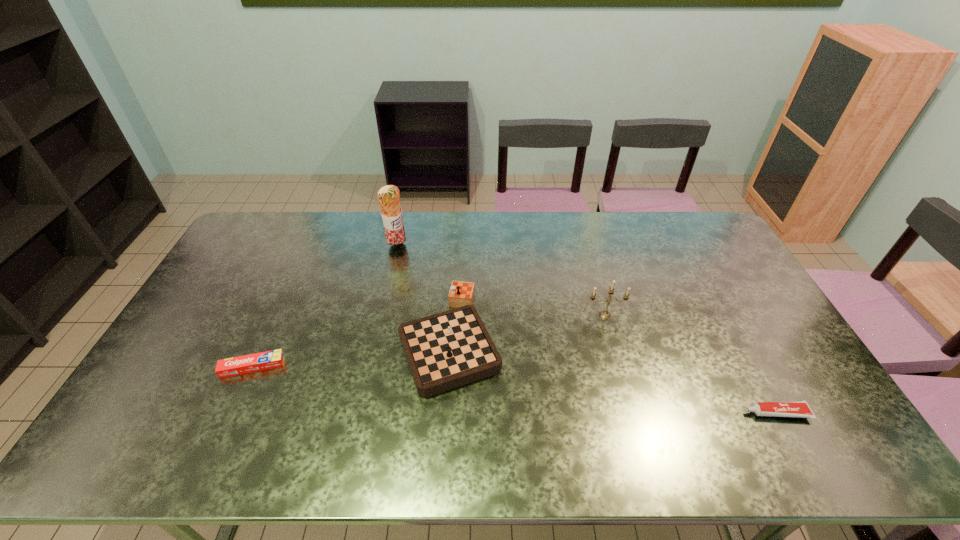
Locate an element on the screen. the tallest object is located at coordinates (388, 196).

This screenshot has width=960, height=540. What are the coordinates of `the farthest object` in the screenshot? It's located at (388, 196).

Locate an element on the screen. The height and width of the screenshot is (540, 960). candle is located at coordinates (604, 314).

In order to click on the fourth shortest object in this screenshot , I will do `click(604, 314)`.

Where is `the third object from left to right`? the third object from left to right is located at coordinates (453, 348).

The width and height of the screenshot is (960, 540). Find the location of `chessboard`. chessboard is located at coordinates (453, 348).

At what (x,y) coordinates should I click in order to perform the action: click on the right toothpaste. Please return your answer as a coordinate pair (x, y). This screenshot has height=540, width=960. Looking at the image, I should click on (801, 409).

This screenshot has height=540, width=960. In order to click on the rightmost object in this screenshot , I will do `click(801, 409)`.

Find the location of a particular element. This screenshot has width=960, height=540. the left toothpaste is located at coordinates (266, 360).

Identify the location of the farther toothpaste. (266, 360).